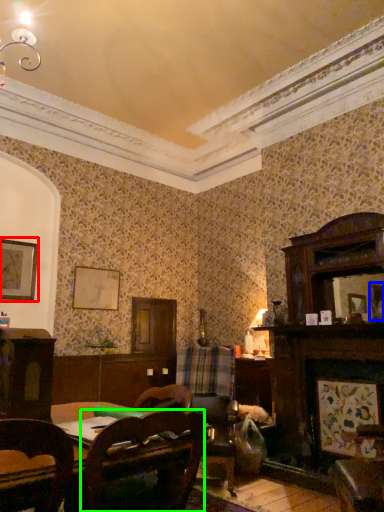
Question: Which is farther away from picture frame (highlighted by a red box)? picture frame (highlighted by a blue box) or chair (highlighted by a green box)?

Choices:
 (A) picture frame
 (B) chair

Answer: (A)